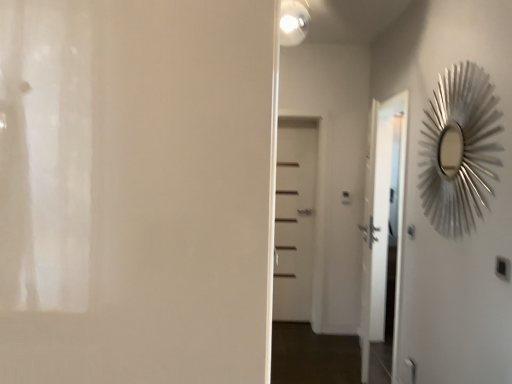
Question: Does white glossy light fixture at upper center have a greater width compared to white matte door at center, the 1th door in the left-to-right sequence?

Choices:
 (A) no
 (B) yes

Answer: (A)

Question: From the image's perspective, is white glossy light fixture at upper center under white matte door at center, positioned as the 1th door in front-to-back order?

Choices:
 (A) no
 (B) yes

Answer: (A)

Question: Are white glossy light fixture at upper center and white matte door at center, the 1th door in the left-to-right sequence, beside each other?

Choices:
 (A) yes
 (B) no

Answer: (B)

Question: Is white matte door at center, the second door viewed from the right, at the back of white glossy light fixture at upper center?

Choices:
 (A) no
 (B) yes

Answer: (A)

Question: Does white glossy light fixture at upper center have a lesser height compared to white matte door at center, the 1th door in the left-to-right sequence?

Choices:
 (A) yes
 (B) no

Answer: (A)

Question: Is white glossy light fixture at upper center at the left side of white matte door at center, positioned as the 2th door in back-to-front order?

Choices:
 (A) yes
 (B) no

Answer: (B)

Question: Is silver metallic sunburst mirror at upper right next to white glossy light fixture at upper center and touching it?

Choices:
 (A) yes
 (B) no

Answer: (B)

Question: From a real-world perspective, is silver metallic sunburst mirror at upper right physically above white glossy light fixture at upper center?

Choices:
 (A) yes
 (B) no

Answer: (B)

Question: Can you confirm if silver metallic sunburst mirror at upper right is bigger than white glossy light fixture at upper center?

Choices:
 (A) no
 (B) yes

Answer: (B)

Question: Can you confirm if silver metallic sunburst mirror at upper right is wider than white glossy light fixture at upper center?

Choices:
 (A) no
 (B) yes

Answer: (A)

Question: From the image's perspective, is silver metallic sunburst mirror at upper right on white glossy light fixture at upper center?

Choices:
 (A) no
 (B) yes

Answer: (A)

Question: Is the depth of silver metallic sunburst mirror at upper right greater than that of white glossy light fixture at upper center?

Choices:
 (A) yes
 (B) no

Answer: (B)

Question: Is white matte door at center, the first door positioned from the back, inside white glossy light fixture at upper center?

Choices:
 (A) yes
 (B) no

Answer: (B)